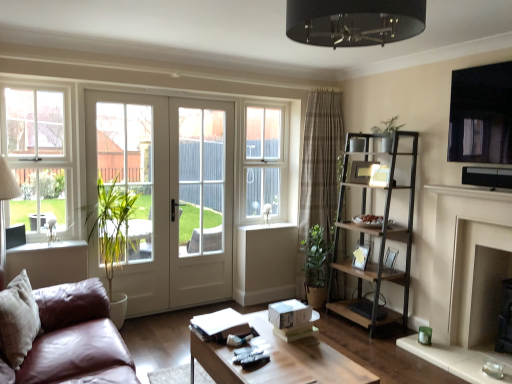
Question: Considering the positions of matte black picture frame at right and green matte plant at upper right in the image, is matte black picture frame at right wider or thinner than green matte plant at upper right?

Choices:
 (A) thin
 (B) wide

Answer: (A)

Question: Considering the relative positions of matte black picture frame at right and green matte plant at upper right in the image provided, is matte black picture frame at right to the left or to the right of green matte plant at upper right?

Choices:
 (A) right
 (B) left

Answer: (A)

Question: Considering the real-world distances, which object is farthest from the wooden coffee table at center?

Choices:
 (A) matte black picture frame at right
 (B) beige fabric pillow at lower left
 (C) white glossy screen door at center
 (D) green matte plant at upper right
 (E) matte black tv at upper right

Answer: (D)

Question: Which is farther from the white wood window at center, the 1th window when ordered from right to left?

Choices:
 (A) wooden coffee table at center
 (B) beige fabric pillow at lower left
 (C) matte black picture frame at right
 (D) white matte fireplace at right
 (E) white glossy screen door at center

Answer: (B)